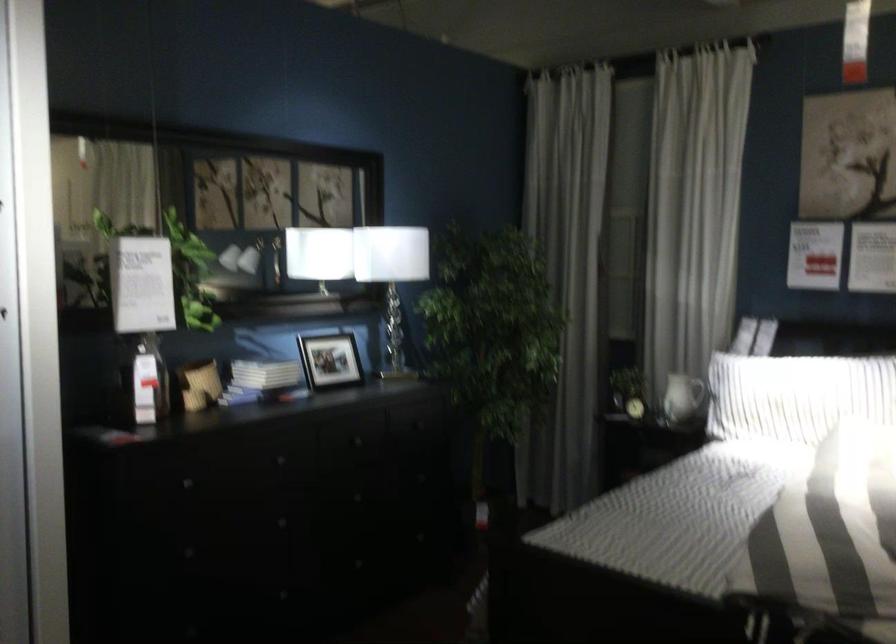
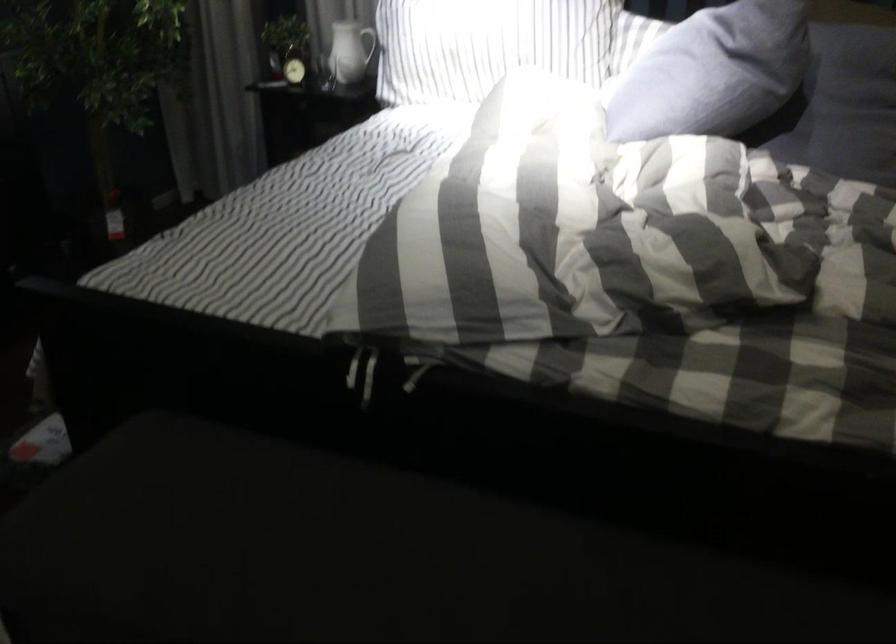
How did the camera likely rotate?

The camera rotated toward right-down.